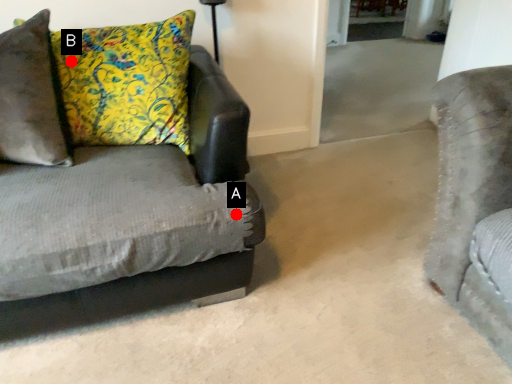
Question: Two points are circled on the image, labeled by A and B beside each circle. Which of the following is the farthest from the observer?

Choices:
 (A) A is further
 (B) B is further

Answer: (B)